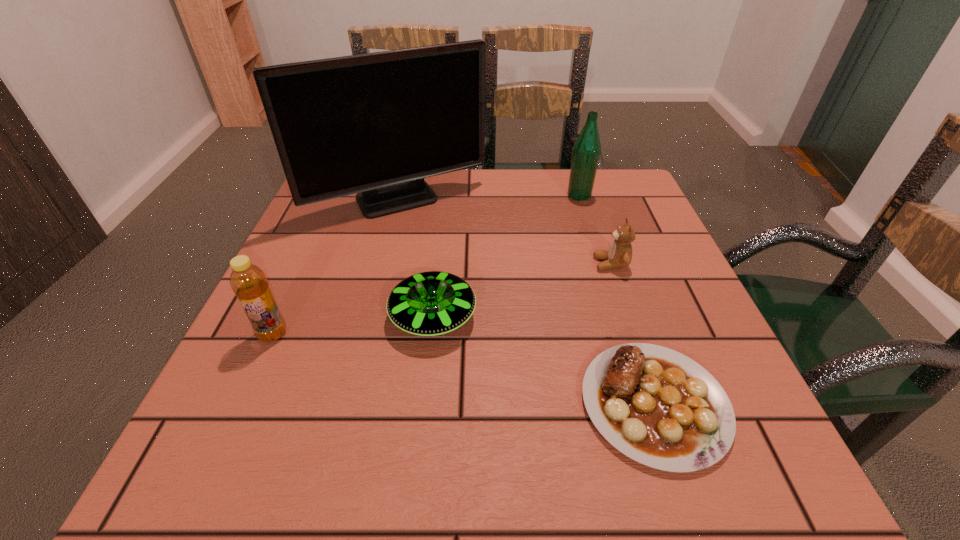
Where is `free spot at the right edge of the desktop`? free spot at the right edge of the desktop is located at coordinates point(732,371).

You are a GUI agent. You are given a task and a screenshot of the screen. Output one action in this format:
    pyautogui.click(x=<x>, y=<y>)
    Task: Click on the vacant space at the far left corner of the desktop
    
    Given the screenshot: What is the action you would take?
    pyautogui.click(x=319, y=209)

The height and width of the screenshot is (540, 960). I want to click on free space at the far right corner of the desktop, so click(607, 181).

In the image, there is a desktop. Where is `vacant space at the near right corner`? vacant space at the near right corner is located at coordinates (752, 489).

The height and width of the screenshot is (540, 960). What are the coordinates of `empty location between the saucer and the tallest object` in the screenshot? It's located at (416, 259).

You are a GUI agent. You are given a task and a screenshot of the screen. Output one action in this format:
    pyautogui.click(x=<x>, y=<y>)
    Task: Click on the vacant point located between the fifth tallest object and the left bottle
    This screenshot has width=960, height=540.
    Given the screenshot: What is the action you would take?
    pyautogui.click(x=353, y=326)

Locate an element on the screen. This screenshot has width=960, height=540. free area in between the computer monitor and the saucer is located at coordinates (416, 259).

Where is `free point between the left bottle and the steak`? The width and height of the screenshot is (960, 540). free point between the left bottle and the steak is located at coordinates (464, 369).

Where is `vacant space that's between the saucer and the steak`? Image resolution: width=960 pixels, height=540 pixels. vacant space that's between the saucer and the steak is located at coordinates pyautogui.click(x=543, y=361).

Where is `free space between the shortest object and the fifth tallest object`? The width and height of the screenshot is (960, 540). free space between the shortest object and the fifth tallest object is located at coordinates (543, 361).